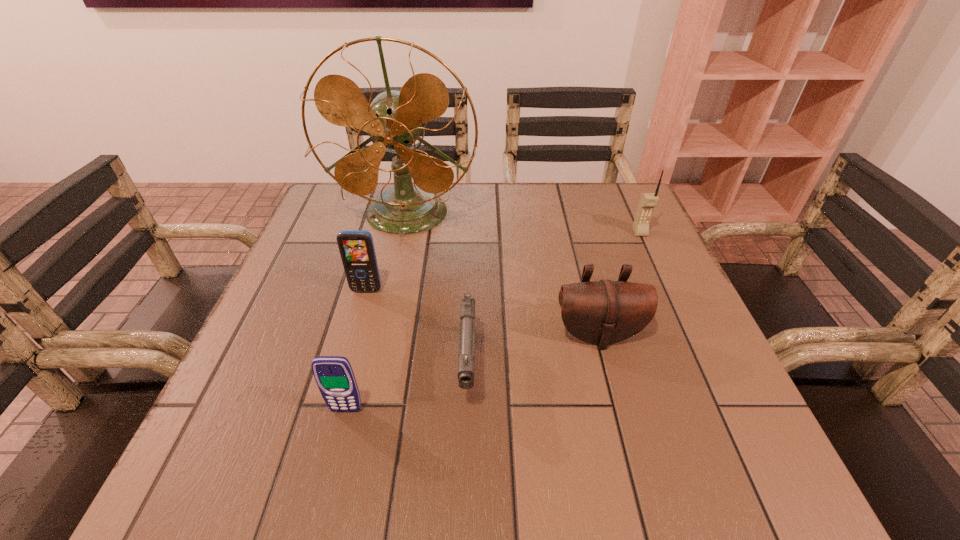
In the image, there is a desktop. Find the location of `free space at the far edge`. free space at the far edge is located at coordinates (545, 187).

What are the coordinates of `free region at the near edge` in the screenshot? It's located at (608, 437).

The height and width of the screenshot is (540, 960). In the image, there is a desktop. In order to click on vacant space at the left edge in this screenshot , I will do `click(267, 358)`.

Find the location of a particular element. blank space at the right edge of the desktop is located at coordinates (687, 308).

This screenshot has height=540, width=960. Find the location of `vacant space at the far left corner`. vacant space at the far left corner is located at coordinates (360, 228).

Locate an element on the screen. vacant space that's between the rightmost cellular telephone and the gun is located at coordinates (554, 300).

This screenshot has width=960, height=540. In order to click on free area in between the gun and the rightmost cellular telephone in this screenshot , I will do `click(554, 300)`.

Locate an element on the screen. vacant space that is in between the second farthest cellular telephone and the farthest cellular telephone is located at coordinates (503, 261).

This screenshot has width=960, height=540. I want to click on vacant point located between the rightmost object and the gun, so click(x=554, y=300).

At what (x,y) coordinates should I click in order to perform the action: click on free space that is in between the farthest cellular telephone and the gun. Please return your answer as a coordinate pair (x, y). Looking at the image, I should click on (554, 300).